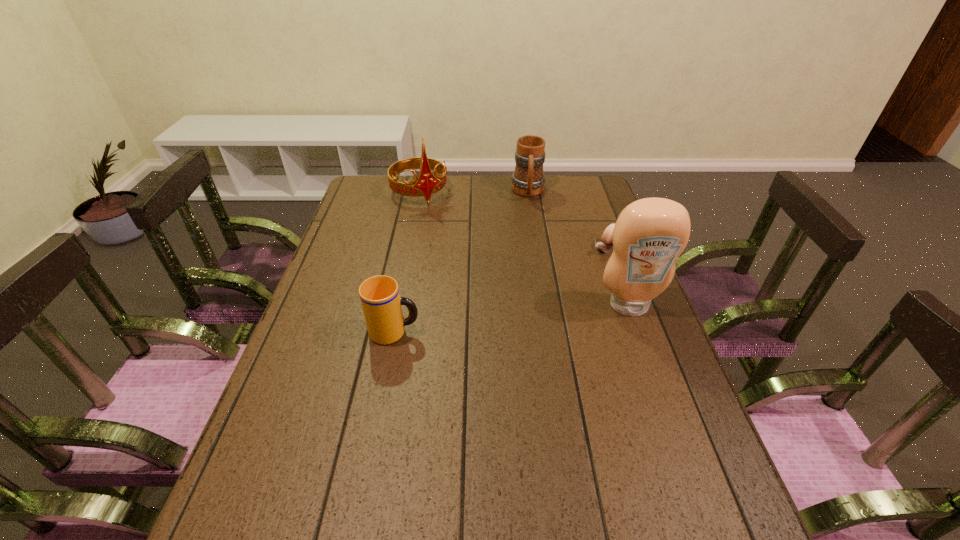
This screenshot has height=540, width=960. I want to click on vacant space in between the shortest object and the second tallest object, so click(x=513, y=220).

Locate an element on the screen. This screenshot has height=540, width=960. vacant area between the second tallest object and the third object from right to left is located at coordinates (474, 192).

Identify the location of free area in between the cup and the second tallest object. This screenshot has height=540, width=960. (407, 262).

Find the location of `free space between the third object from left to right and the tallest object`. free space between the third object from left to right and the tallest object is located at coordinates (579, 249).

Where is `free space between the mug and the fourth tallest object`? free space between the mug and the fourth tallest object is located at coordinates (462, 262).

You are a GUI agent. You are given a task and a screenshot of the screen. Output one action in this format:
    pyautogui.click(x=<x>, y=<y>)
    Task: Click on the vacant region between the fourth shortest object and the condiment
    This screenshot has width=960, height=540.
    Given the screenshot: What is the action you would take?
    pyautogui.click(x=524, y=249)

The height and width of the screenshot is (540, 960). Find the location of `free space between the mug and the tiara`. free space between the mug and the tiara is located at coordinates (474, 192).

The width and height of the screenshot is (960, 540). I want to click on free space between the third nearest object and the cup, so click(500, 290).

Where is `vacant space in between the second shortest object and the fourth shortest object`? vacant space in between the second shortest object and the fourth shortest object is located at coordinates (407, 262).

Where is `object that is the third closest one to the mug`? The image size is (960, 540). object that is the third closest one to the mug is located at coordinates tap(649, 235).